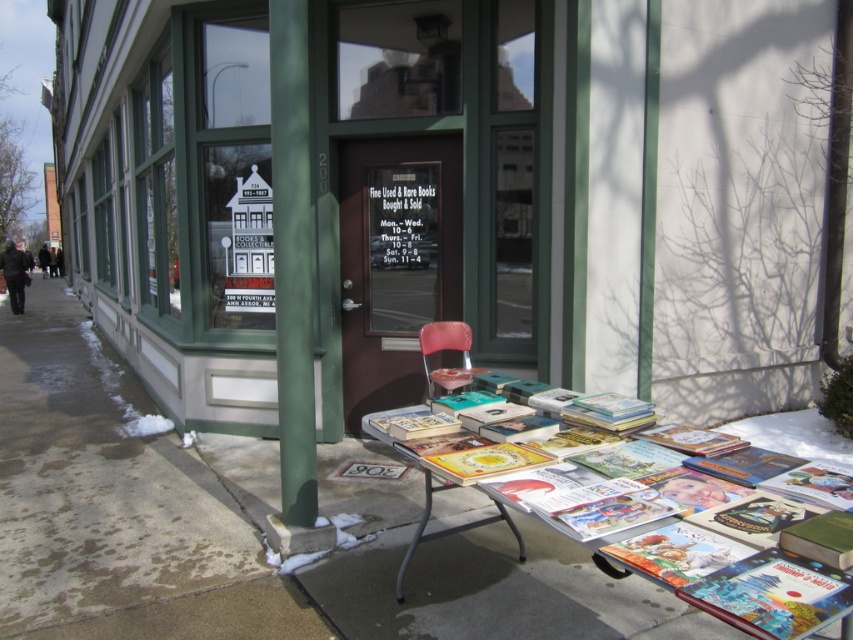
From the picture: You are standing in front of the bookstore at 200 N Fourth Ave, Ann Arbor, Michigan. You see two points marked on the storefront. The first point is at coordinates point (x=196, y=122) and the second is at point (x=144, y=436). Which point is closer to you?

Point (x=196, y=122) is in front of point (x=144, y=436), so the first point is closer to you.

You are standing in front of the bookstore at 200 N Fourth Ave, Ann Arbor, Michigan. You need to place a small potted plant on the smooth concrete pavement at lower center. Where exactly should you place it?

You should place the small potted plant at point (247, 528) on the smooth concrete pavement at lower center.